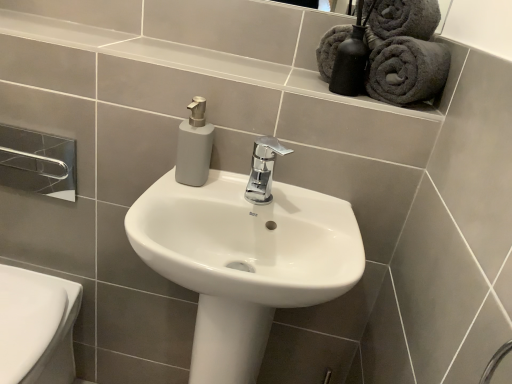
This screenshot has width=512, height=384. Describe the element at coordinates (480, 342) in the screenshot. I see `gray matte tile at lower right` at that location.

Find the location of a particular element. This screenshot has width=512, height=384. white glossy sink at center is located at coordinates (245, 256).

Locate an element on the screen. chrome metallic towel bar at upper left is located at coordinates (38, 162).

Locate an element on the screen. Image resolution: width=512 pixels, height=384 pixels. white glossy bidet at lower left is located at coordinates (36, 326).

Does white glossy bidet at lower left appear on the left side of chrome metallic towel bar at upper left?

Correct, you'll find white glossy bidet at lower left to the left of chrome metallic towel bar at upper left.

Would you consider white glossy bidet at lower left to be distant from chrome metallic towel bar at upper left?

No, there isn't a large distance between white glossy bidet at lower left and chrome metallic towel bar at upper left.

Find the location of a particular element. The width and height of the screenshot is (512, 384). bidet on the left of chrome metallic towel bar at upper left is located at coordinates (36, 326).

Based on the photo, from the image's perspective, which one is positioned higher, white glossy bidet at lower left or chrome metallic towel bar at upper left?

chrome metallic towel bar at upper left, from the image's perspective.

Is gray plush towels at upper right, marked as the 1th bath towel in a left-to-right arrangement, outside of chrome metallic towel bar at upper left?

Absolutely, gray plush towels at upper right, marked as the 1th bath towel in a left-to-right arrangement, is external to chrome metallic towel bar at upper left.

The height and width of the screenshot is (384, 512). I want to click on towel bar below the gray plush towels at upper right, marked as the 1th bath towel in a left-to-right arrangement (from the image's perspective), so click(38, 162).

Can you confirm if gray plush towels at upper right, marked as the 1th bath towel in a left-to-right arrangement, is thinner than chrome metallic towel bar at upper left?

In fact, gray plush towels at upper right, marked as the 1th bath towel in a left-to-right arrangement, might be wider than chrome metallic towel bar at upper left.

Is gray plush towels at upper right, marked as the third bath towel in a right-to-left arrangement, oriented towards chrome metallic towel bar at upper left?

No.

Considering the sizes of objects chrome metallic faucet at center and gray plush towels at upper right, marked as the third bath towel in a right-to-left arrangement, in the image provided, who is shorter, chrome metallic faucet at center or gray plush towels at upper right, marked as the third bath towel in a right-to-left arrangement,?

Standing shorter between the two is chrome metallic faucet at center.

Is chrome metallic faucet at center beside gray plush towels at upper right, marked as the 1th bath towel in a left-to-right arrangement?

No, chrome metallic faucet at center is not making contact with gray plush towels at upper right, marked as the 1th bath towel in a left-to-right arrangement.

Could you tell me if chrome metallic faucet at center is turned towards gray plush towels at upper right, marked as the 1th bath towel in a left-to-right arrangement?

No, chrome metallic faucet at center is not oriented towards gray plush towels at upper right, marked as the 1th bath towel in a left-to-right arrangement.

From the image's perspective, relative to gray plush towels at upper right, marked as the 1th bath towel in a left-to-right arrangement, is chrome metallic faucet at center above or below?

Clearly, from the image's perspective, chrome metallic faucet at center is below gray plush towels at upper right, marked as the 1th bath towel in a left-to-right arrangement.

Would you say dark grey plush bath towel at upper right, the 2th bath towel positioned from the left, is to the left or to the right of white glossy sink at center in the picture?

Based on their positions, dark grey plush bath towel at upper right, the 2th bath towel positioned from the left, is located to the right of white glossy sink at center.

Is dark grey plush bath towel at upper right, the 2th bath towel positioned from the left, oriented away from white glossy sink at center?

dark grey plush bath towel at upper right, the 2th bath towel positioned from the left, is not turned away from white glossy sink at center.

Which point is more distant from viewer, [411,88] or [200,337]?

The point [200,337] is behind.

Is chrome metallic towel bar at upper left at the left side of chrome metallic faucet at center?

Yes.

In terms of size, does chrome metallic towel bar at upper left appear bigger or smaller than chrome metallic faucet at center?

In the image, chrome metallic towel bar at upper left appears to be smaller than chrome metallic faucet at center.

Identify the location of towel bar to the left of chrome metallic faucet at center. The width and height of the screenshot is (512, 384). (38, 162).

Could you tell me if chrome metallic towel bar at upper left is facing chrome metallic faucet at center?

No, chrome metallic towel bar at upper left is not facing towards chrome metallic faucet at center.

From the picture: Considering the sizes of objects dark gray plush towel at upper right, which is counted as the third bath towel, starting from the left, and chrome metallic towel bar at upper left in the image provided, who is bigger, dark gray plush towel at upper right, which is counted as the third bath towel, starting from the left, or chrome metallic towel bar at upper left?

dark gray plush towel at upper right, which is counted as the third bath towel, starting from the left, is bigger.

Is point (401, 3) more distant than point (55, 182)?

No, it is not.

Is dark gray plush towel at upper right, which ranks as the 1th bath towel in right-to-left order, turned away from chrome metallic towel bar at upper left?

No, dark gray plush towel at upper right, which ranks as the 1th bath towel in right-to-left order, is not facing away from chrome metallic towel bar at upper left.

Measure the distance between dark gray plush towel at upper right, which ranks as the 1th bath towel in right-to-left order, and chrome metallic towel bar at upper left.

→ dark gray plush towel at upper right, which ranks as the 1th bath towel in right-to-left order, is 3.88 feet away from chrome metallic towel bar at upper left.

Is dark grey plush bath towel at upper right, the 2th bath towel positioned from the left, thinner than white glossy bidet at lower left?

Yes, dark grey plush bath towel at upper right, the 2th bath towel positioned from the left, is thinner than white glossy bidet at lower left.

Would you say dark grey plush bath towel at upper right, the 2th bath towel positioned from the left, is inside or outside white glossy bidet at lower left?

dark grey plush bath towel at upper right, the 2th bath towel positioned from the left, is spatially situated outside white glossy bidet at lower left.

Does dark grey plush bath towel at upper right, the 2th bath towel when ordered from right to left, have a lesser height compared to white glossy bidet at lower left?

Yes.

Image resolution: width=512 pixels, height=384 pixels. I want to click on bidet directly beneath the chrome metallic towel bar at upper left (from a real-world perspective), so click(x=36, y=326).

This screenshot has height=384, width=512. What are the coordinates of `the 2nd bath towel positioned above the chrome metallic towel bar at upper left (from the image's perspective)` in the screenshot? It's located at (404, 51).

Estimate the real-world distances between objects in this image. Which object is further from dark grey plush bath towel at upper right, the 2th bath towel positioned from the left, chrome metallic towel bar at upper left or dark gray plush towel at upper right, which is counted as the third bath towel, starting from the left?

Based on the image, chrome metallic towel bar at upper left appears to be further to dark grey plush bath towel at upper right, the 2th bath towel positioned from the left.

Estimate the real-world distances between objects in this image. Which object is further from white glossy sink at center, gray plush towels at upper right, marked as the 1th bath towel in a left-to-right arrangement, or chrome metallic faucet at center?

Based on the image, gray plush towels at upper right, marked as the 1th bath towel in a left-to-right arrangement, appears to be further to white glossy sink at center.

Estimate the real-world distances between objects in this image. Which object is closer to white glossy bidet at lower left, chrome metallic towel bar at upper left or gray matte tile at lower right?

chrome metallic towel bar at upper left.

Looking at the image, which one is located closer to gray matte tile at lower right, dark grey plush bath towel at upper right, the 2th bath towel positioned from the left, or gray plush towels at upper right, marked as the 1th bath towel in a left-to-right arrangement?

Based on the image, dark grey plush bath towel at upper right, the 2th bath towel positioned from the left, appears to be nearer to gray matte tile at lower right.

Which object lies further to the anchor point gray matte tile at lower right, white glossy bidet at lower left or white glossy sink at center?

The object further to gray matte tile at lower right is white glossy bidet at lower left.

Looking at this image, looking at the image, which one is located closer to gray matte tile at lower right, dark grey plush bath towel at upper right, the 2th bath towel positioned from the left, or chrome metallic faucet at center?

Among the two, chrome metallic faucet at center is located nearer to gray matte tile at lower right.

Estimate the real-world distances between objects in this image. Which object is further from dark grey plush bath towel at upper right, the 2th bath towel when ordered from right to left, dark gray plush towel at upper right, which ranks as the 1th bath towel in right-to-left order, or white glossy sink at center?

white glossy sink at center lies further to dark grey plush bath towel at upper right, the 2th bath towel when ordered from right to left, than the other object.

When comparing their distances from white glossy sink at center, does white glossy bidet at lower left or gray matte tile at lower right seem closer?

gray matte tile at lower right is positioned closer to the anchor white glossy sink at center.

At what (x,y) coordinates should I click in order to perform the action: click on towel bar located between white glossy bidet at lower left and white glossy sink at center in the left-right direction. Please return your answer as a coordinate pair (x, y). The height and width of the screenshot is (384, 512). Looking at the image, I should click on (38, 162).

Where is `bath towel that lies between gray plush towels at upper right, marked as the third bath towel in a right-to-left arrangement, and white glossy sink at center from top to bottom`? bath towel that lies between gray plush towels at upper right, marked as the third bath towel in a right-to-left arrangement, and white glossy sink at center from top to bottom is located at coordinates (407, 70).

Identify the location of towel bar situated between white glossy bidet at lower left and gray plush towels at upper right, marked as the 1th bath towel in a left-to-right arrangement, from left to right. (38, 162).

This screenshot has width=512, height=384. What are the coordinates of `sink situated between chrome metallic towel bar at upper left and dark grey plush bath towel at upper right, the 2th bath towel positioned from the left, from left to right` in the screenshot? It's located at (245, 256).